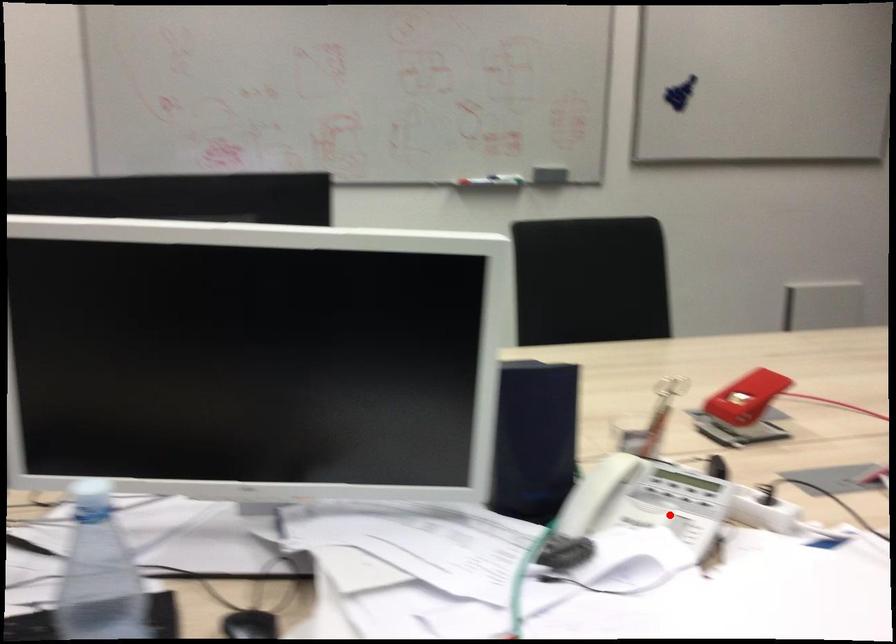
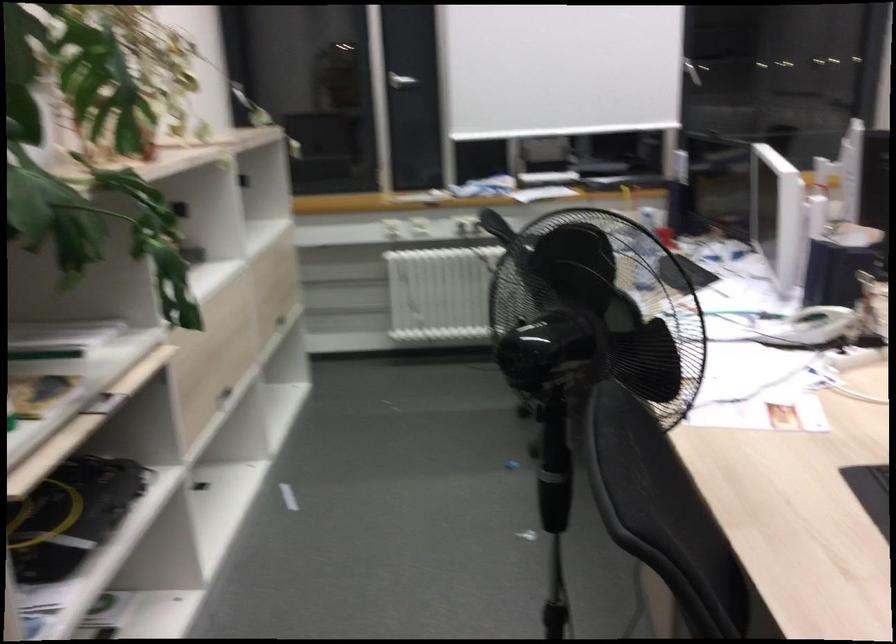
Question: I am providing you with two images of the same scene from different viewpoints. In image1, a red point is highlighted. Considering the same 3D point in image2, which of the following is correct?

Choices:
 (A) It is closer
 (B) It is farther

Answer: (B)